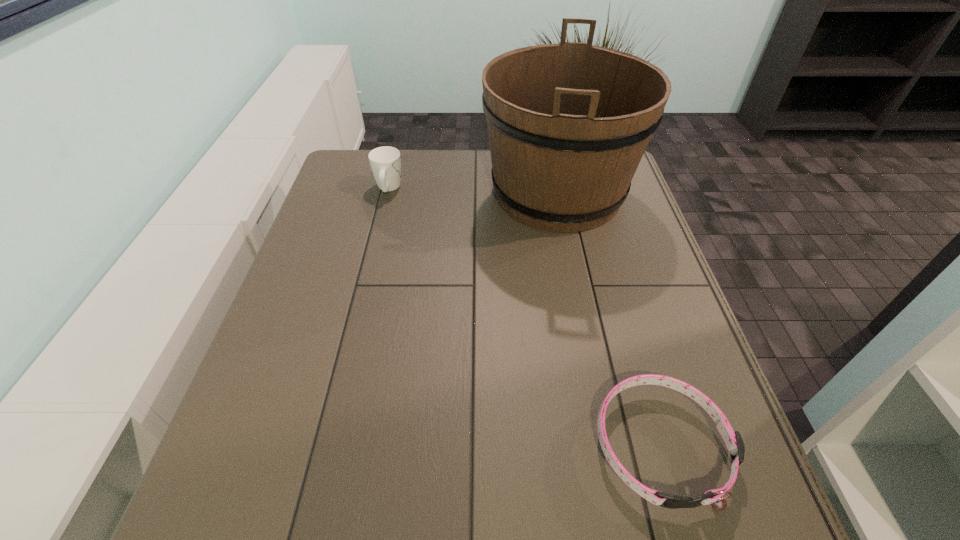
Where is `empty space that is in between the mug and the tallest object`? The image size is (960, 540). empty space that is in between the mug and the tallest object is located at coordinates (473, 191).

At what (x,y) coordinates should I click in order to perform the action: click on vacant area between the tallest object and the shortest object. Please return your answer as a coordinate pair (x, y). Looking at the image, I should click on (609, 319).

Find the location of `the second closest object relative to the second tallest object`. the second closest object relative to the second tallest object is located at coordinates (733, 440).

Identify the location of object that is the second closest one to the mug. (733, 440).